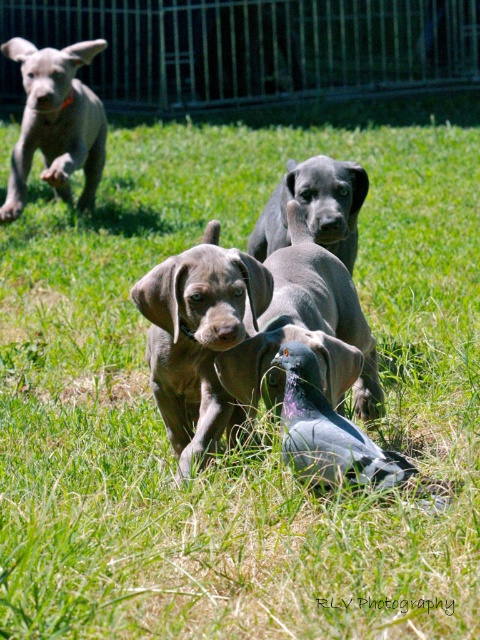
Between point (201, 314) and point (216, 364), which one is positioned in front?

Point (201, 314)

The image size is (480, 640). Describe the element at coordinates (197, 337) in the screenshot. I see `shiny gray puppy at center` at that location.

This screenshot has width=480, height=640. What are the coordinates of `shiny gray puppy at center` in the screenshot? It's located at (197, 337).

Is shiny gray puppy at center thinner than shiny black puppy at center?

Correct, shiny gray puppy at center's width is less than shiny black puppy at center's.

Can you confirm if shiny gray puppy at center is bigger than shiny black puppy at center?

Incorrect, shiny gray puppy at center is not larger than shiny black puppy at center.

Where is `shiny gray puppy at center`? This screenshot has width=480, height=640. shiny gray puppy at center is located at coordinates (197, 337).

Between smooth gray dog at center and smooth gray puppy at upper left, which one is positioned lower?

smooth gray dog at center

This screenshot has height=640, width=480. Describe the element at coordinates (305, 330) in the screenshot. I see `smooth gray dog at center` at that location.

Where is `smooth gray dog at center`? The image size is (480, 640). smooth gray dog at center is located at coordinates [x=305, y=330].